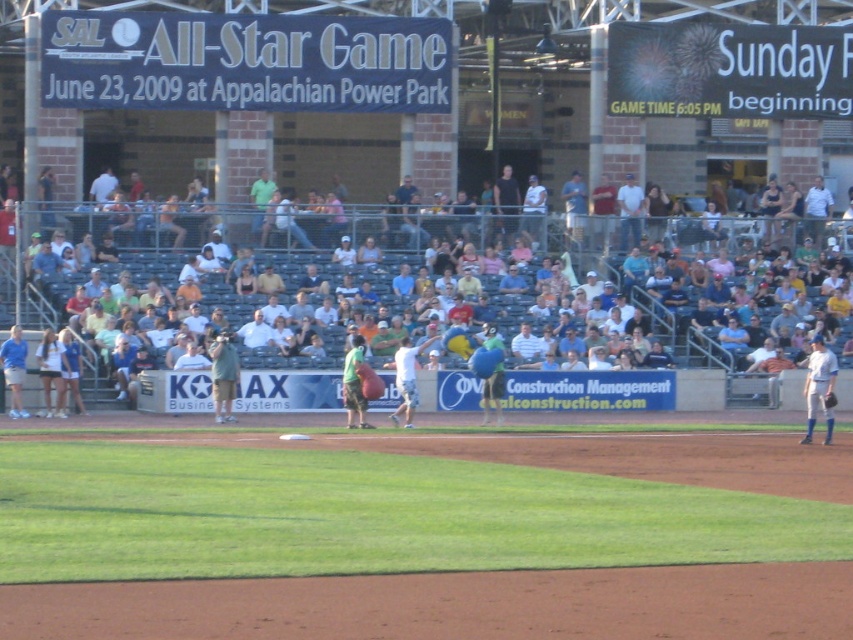
You are a photographer at the baseball stadium and want to take a photo of the white uniform at center and the blue fabric bag at center. Which object should you focus on first if you want to capture both in the frame without moving the camera?

The white uniform at center is taller than the blue fabric bag at center, so you should focus on the white uniform at center first to ensure both are in frame.

You are a photographer at the baseball stadium and want to capture both the black matte shirt at upper center and the blue fabric bag at center in a single shot. Which object should you frame first to ensure both are included in the photo?

The black matte shirt at upper center should be framed first since it is positioned to the left of the blue fabric bag at center, ensuring both are included in the shot.

You are a spectator at the baseball stadium and want to locate both the white uniform at center and the blue fabric bag at center. From your perspective, which object is positioned to the right?

The white uniform at center is positioned to the right of the blue fabric bag at center.